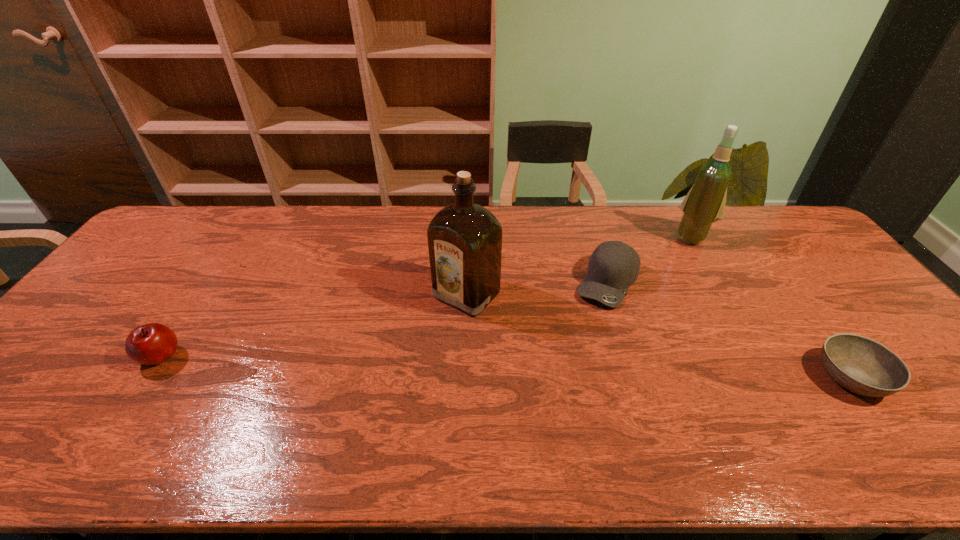
What are the coordinates of `free location located 0.290m on the front brim of the third object from left to right` in the screenshot? It's located at (564, 386).

Where is `free space located on the front brim of the third object from left to right`? Image resolution: width=960 pixels, height=540 pixels. free space located on the front brim of the third object from left to right is located at coordinates (555, 405).

Find the location of `vacant area situated on the front-facing side of the second object from right to left`. vacant area situated on the front-facing side of the second object from right to left is located at coordinates (658, 287).

Locate an element on the screen. The width and height of the screenshot is (960, 540). free spot located 0.090m on the front-facing side of the second object from right to left is located at coordinates (677, 260).

You are a GUI agent. You are given a task and a screenshot of the screen. Output one action in this format:
    pyautogui.click(x=<x>, y=<y>)
    Task: Click on the free space located 0.150m on the front-facing side of the second object from right to left
    The width and height of the screenshot is (960, 540).
    Given the screenshot: What is the action you would take?
    pyautogui.click(x=669, y=269)

At what (x,y) coordinates should I click in order to perform the action: click on free location located 0.290m on the label of the fourth object from right to left. Please return your answer as a coordinate pair (x, y). Image resolution: width=960 pixels, height=540 pixels. Looking at the image, I should click on (372, 388).

Where is `blank area located on the label of the fourth object from right to left`? This screenshot has width=960, height=540. blank area located on the label of the fourth object from right to left is located at coordinates (396, 365).

Identify the location of free space located 0.260m on the label of the fourth object from right to left. The height and width of the screenshot is (540, 960). (381, 379).

Locate an element on the screen. object at the far edge is located at coordinates (704, 204).

This screenshot has width=960, height=540. What are the coordinates of `object that is at the near edge` in the screenshot? It's located at tap(863, 366).